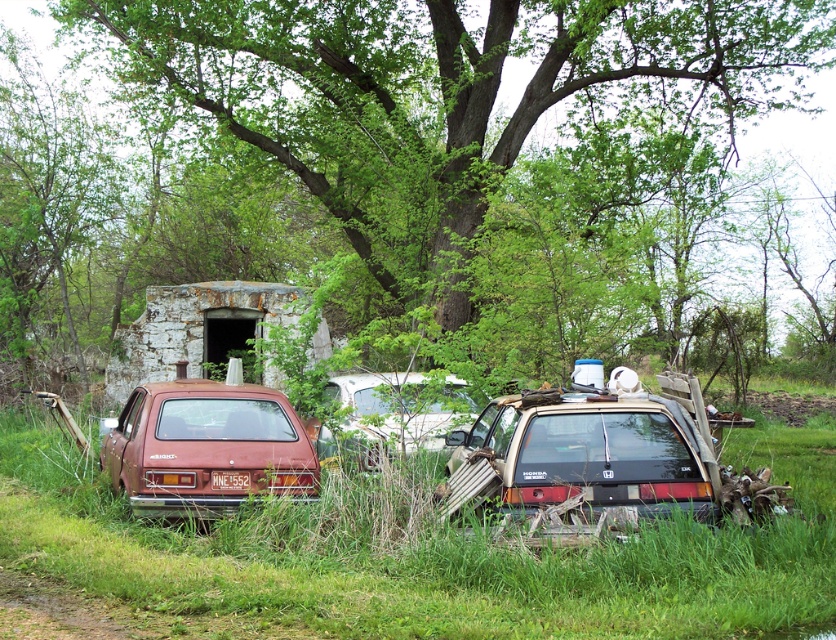
Question: Which of these objects is positioned closest to the rusty metal suv at center?

Choices:
 (A) green grass at center
 (B) rusty metal station wagon at lower left
 (C) green leafy tree at center
 (D) white matte car at center

Answer: (A)

Question: Is rusty metal station wagon at lower left to the left of white matte car at center from the viewer's perspective?

Choices:
 (A) yes
 (B) no

Answer: (A)

Question: Which point is farther to the camera?

Choices:
 (A) (580, 480)
 (B) (732, 65)
 (C) (406, 410)
 (D) (256, 598)

Answer: (B)

Question: Considering the real-world distances, which object is farthest from the rusty metal suv at center?

Choices:
 (A) green grass at center
 (B) rusty metal station wagon at lower left

Answer: (B)

Question: Is green grass at center to the right of white matte car at center from the viewer's perspective?

Choices:
 (A) yes
 (B) no

Answer: (B)

Question: Can you confirm if green grass at center is positioned above rusty metal station wagon at lower left?

Choices:
 (A) no
 (B) yes

Answer: (A)